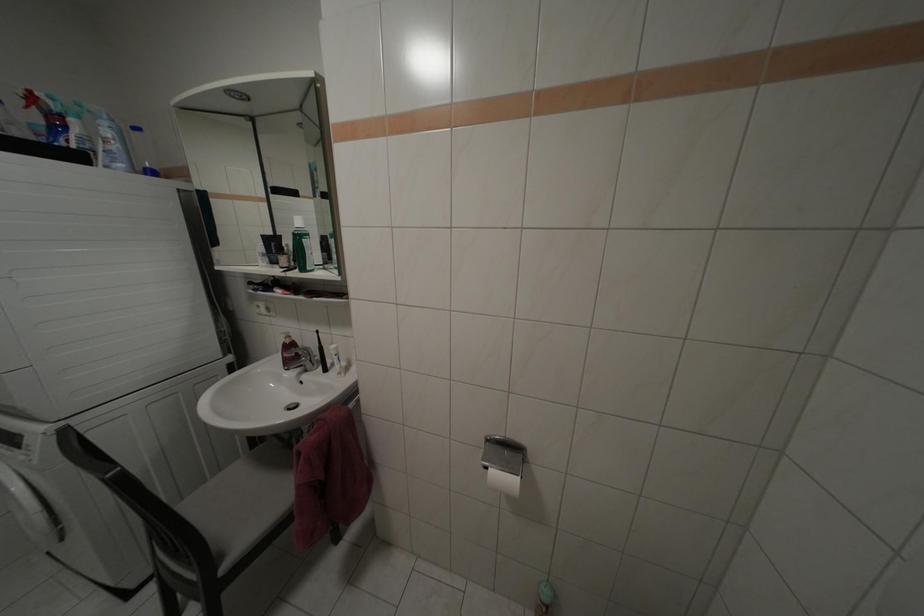
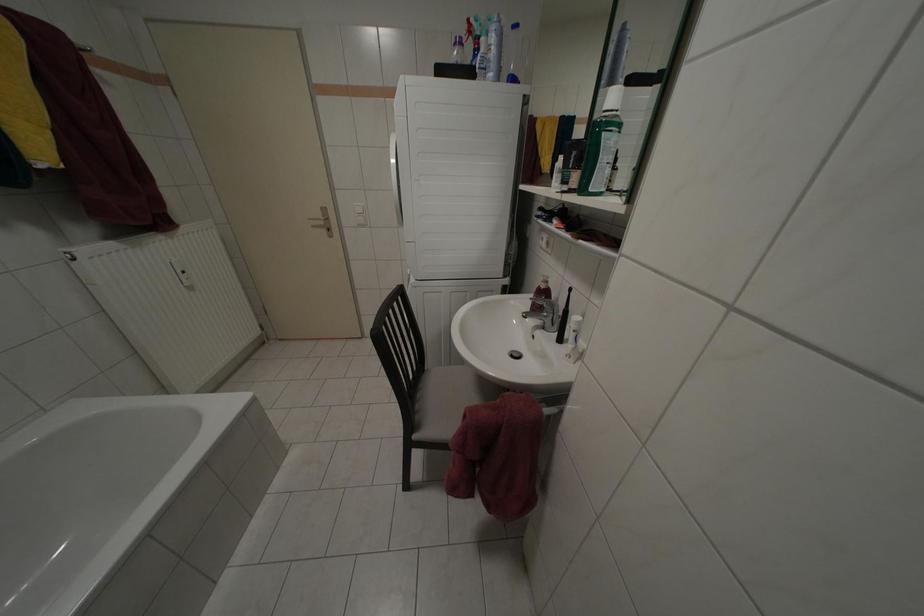
Consider the image. How did the camera likely rotate?

The camera's rotation is toward left-down.